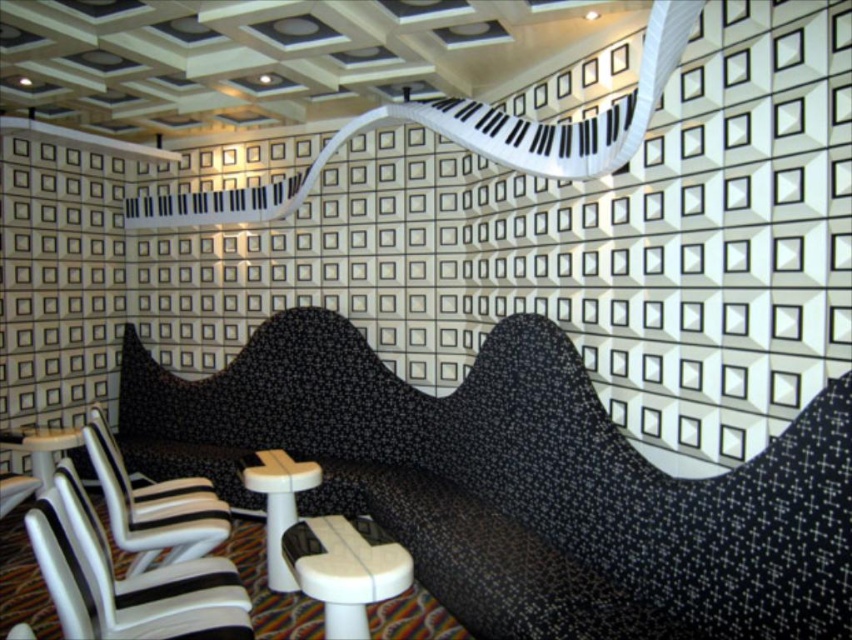
Question: Can you confirm if white textured chair at lower left is positioned below white leather chair at lower left?

Choices:
 (A) yes
 (B) no

Answer: (B)

Question: Does white textured chair at lower left have a greater width compared to white leather chair at lower left?

Choices:
 (A) yes
 (B) no

Answer: (A)

Question: Which object appears closest to the camera in this image?

Choices:
 (A) white leather chair at lower left
 (B) white textured chair at lower left

Answer: (B)

Question: Which of the following is the farthest from the observer?

Choices:
 (A) (487, 616)
 (B) (170, 522)

Answer: (B)

Question: Is white textured chair at lower left closer to camera compared to white leather chair at lower left?

Choices:
 (A) no
 (B) yes

Answer: (B)